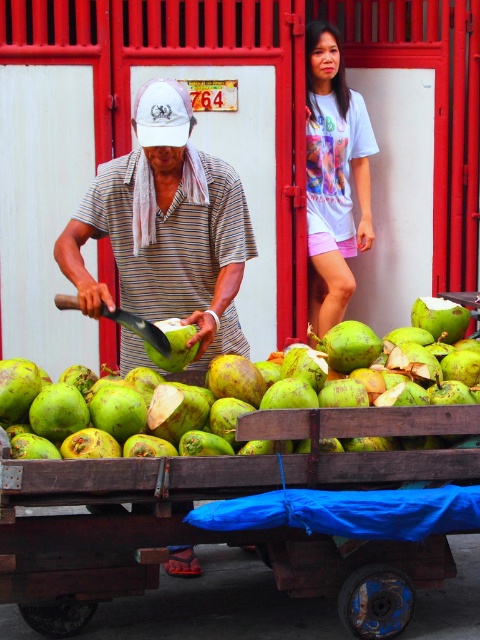
Question: Which object appears closest to the camera in this image?

Choices:
 (A) light blue t-shirt at upper center
 (B) green matte coconut at center
 (C) matte striped shirt at center

Answer: (B)

Question: Is matte striped shirt at center behind light blue t-shirt at upper center?

Choices:
 (A) yes
 (B) no

Answer: (B)

Question: Is matte striped shirt at center bigger than green matte coconut at center?

Choices:
 (A) no
 (B) yes

Answer: (A)

Question: Among these objects, which one is farthest from the camera?

Choices:
 (A) matte striped shirt at center
 (B) light blue t-shirt at upper center

Answer: (B)

Question: Does green matte coconut at center lie in front of light blue t-shirt at upper center?

Choices:
 (A) no
 (B) yes

Answer: (B)

Question: Which point is farther from the camera taking this photo?

Choices:
 (A) (320, 124)
 (B) (83, 451)

Answer: (A)